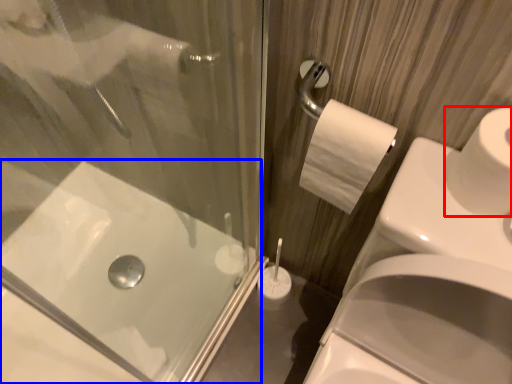
Question: Which object is further to the camera taking this photo, toilet paper (highlighted by a red box) or bath (highlighted by a blue box)?

Choices:
 (A) toilet paper
 (B) bath

Answer: (B)